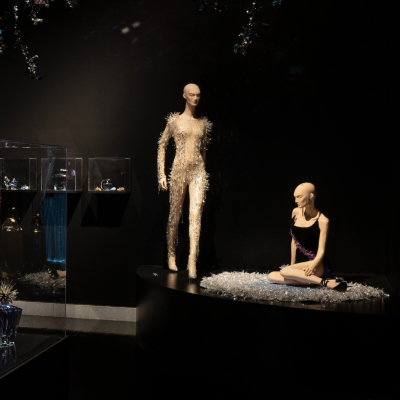
The width and height of the screenshot is (400, 400). Find the location of `display case`. display case is located at coordinates (104, 160), (69, 158).